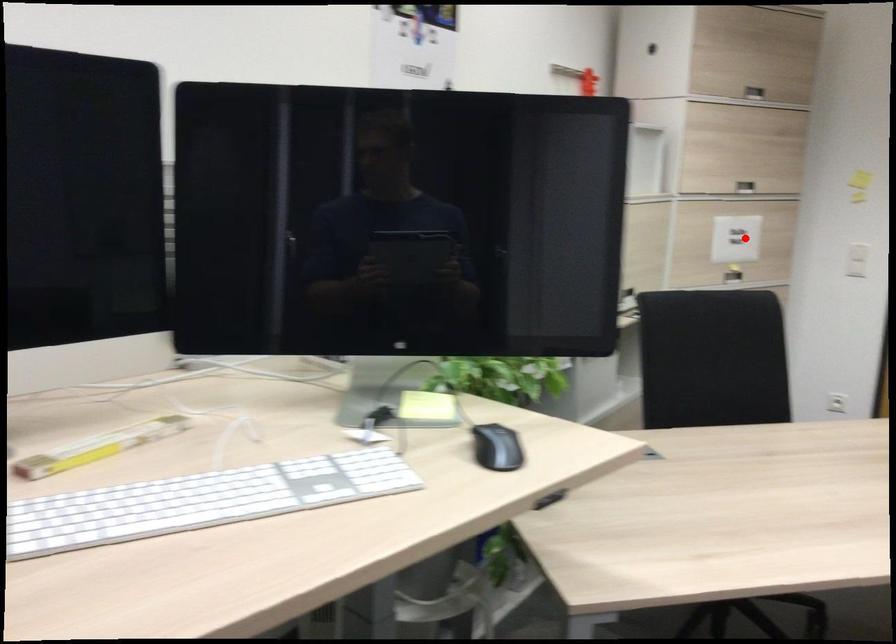
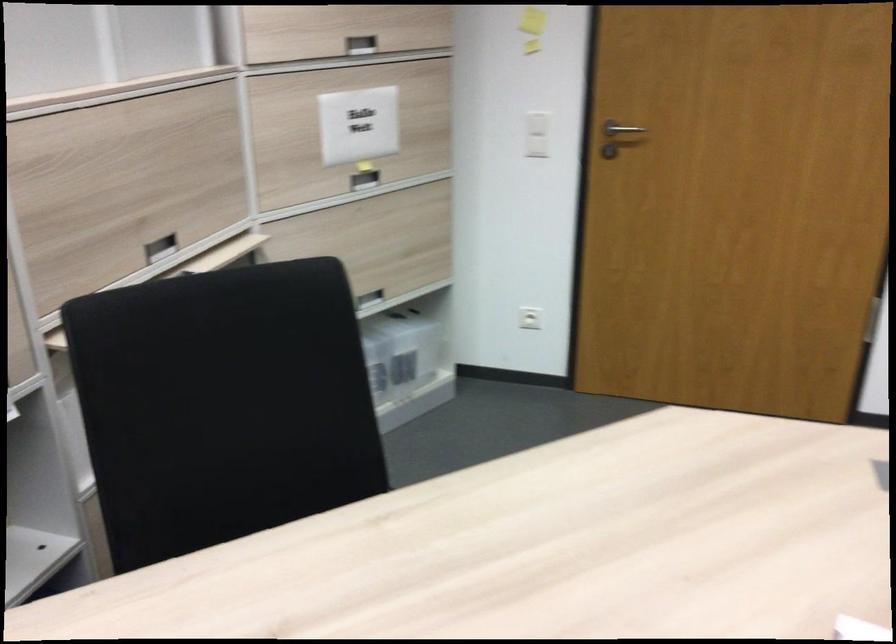
Question: A red point is marked in image1. In image2, is the corresponding 3D point closer to the camera or farther? Reply with the corresponding letter.

Choices:
 (A) The corresponding 3D point is closer.
 (B) The corresponding 3D point is farther.

Answer: (A)